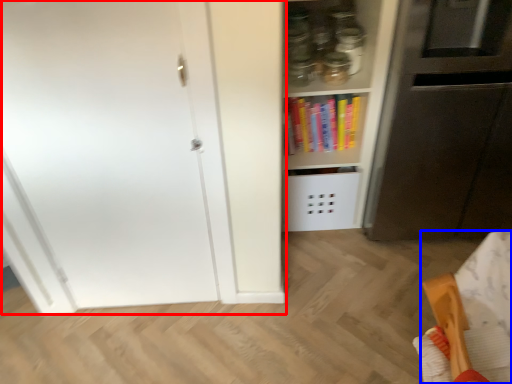
Question: Which point is further to the camera, door (highlighted by a red box) or furniture (highlighted by a blue box)?

Choices:
 (A) door
 (B) furniture

Answer: (A)